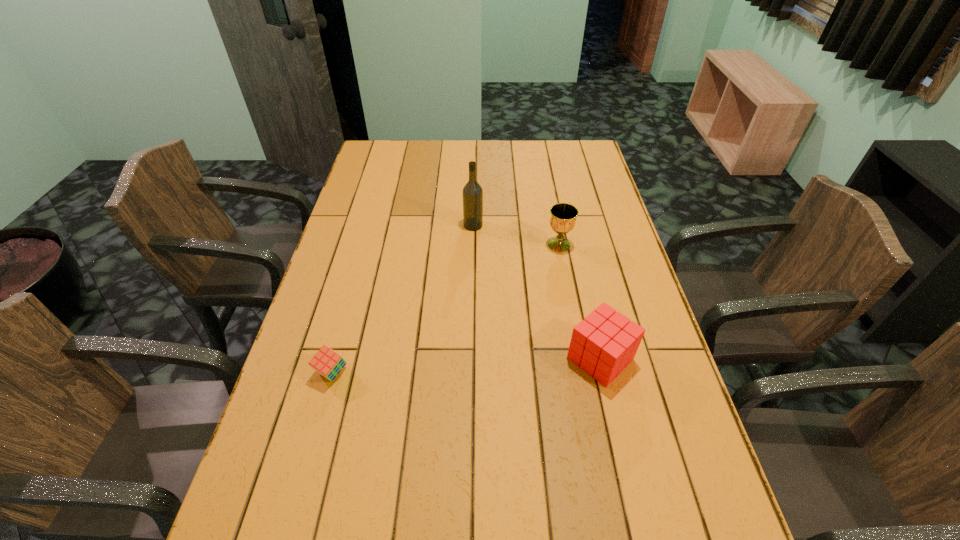
Where is `unoccupied area between the second farthest object and the shorter cube`? The width and height of the screenshot is (960, 540). unoccupied area between the second farthest object and the shorter cube is located at coordinates [x=445, y=309].

Image resolution: width=960 pixels, height=540 pixels. Find the location of `vacant region between the shorter cube and the taller cube`. vacant region between the shorter cube and the taller cube is located at coordinates (466, 366).

Where is `free space between the vodka and the chalice`? This screenshot has height=540, width=960. free space between the vodka and the chalice is located at coordinates (516, 235).

Locate an element on the screen. This screenshot has width=960, height=540. vacant point located between the vodka and the second farthest object is located at coordinates (516, 235).

Locate an element on the screen. This screenshot has height=540, width=960. unoccupied position between the left cube and the chalice is located at coordinates (445, 309).

Locate an element on the screen. The image size is (960, 540). free spot between the chalice and the right cube is located at coordinates (580, 302).

Where is `the second closest object to the shorter cube`? This screenshot has height=540, width=960. the second closest object to the shorter cube is located at coordinates coord(472,192).

I want to click on object that stands as the third closest to the right cube, so click(327, 362).

At what (x,y) coordinates should I click in order to perform the action: click on free location that satisfies the following two spatial constraints: 1. on the front side of the tallest object; 2. on the right side of the third nearest object. Please return your answer as a coordinate pair (x, y). The width and height of the screenshot is (960, 540). Looking at the image, I should click on (472, 245).

Find the location of a particular element. This screenshot has height=540, width=960. vacant space that satisfies the following two spatial constraints: 1. on the front side of the right cube; 2. on the right side of the chalice is located at coordinates (581, 359).